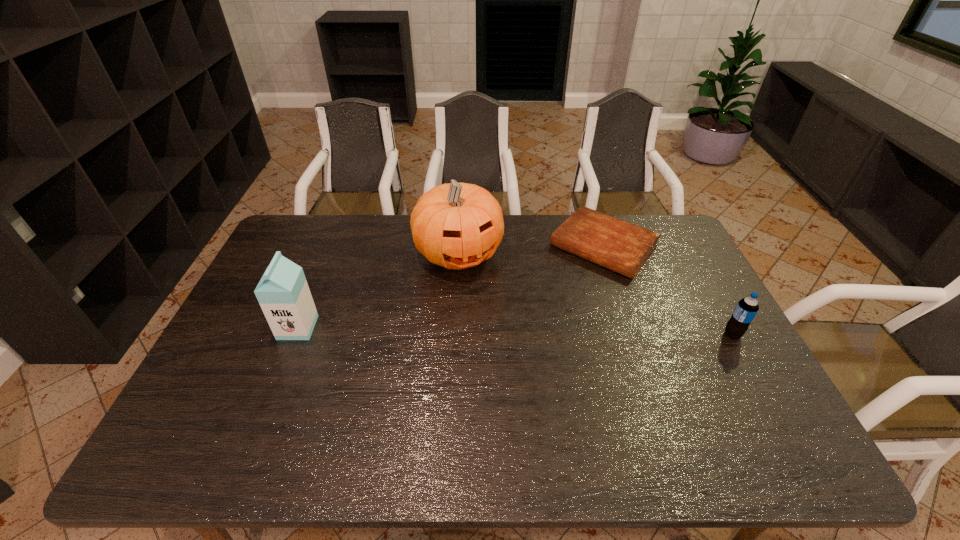
Identify the location of the closest object to the shortest object. The width and height of the screenshot is (960, 540). (457, 226).

Locate an element on the screen. vacant area in the image that satisfies the following two spatial constraints: 1. on the back side of the second tallest object; 2. on the right side of the tallest object is located at coordinates (327, 254).

Where is `free region that satisfies the following two spatial constraints: 1. on the back side of the shortest object; 2. on the right side of the pumpkin`? free region that satisfies the following two spatial constraints: 1. on the back side of the shortest object; 2. on the right side of the pumpkin is located at coordinates (459, 246).

The width and height of the screenshot is (960, 540). Identify the location of vacant space that satisfies the following two spatial constraints: 1. on the front side of the third object from left to right; 2. on the left side of the soda bottle. (633, 334).